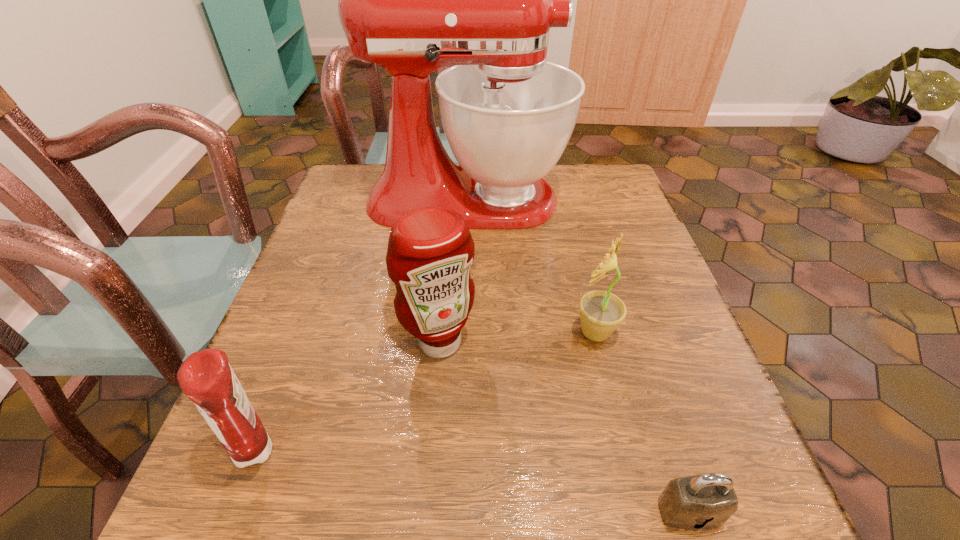
What are the coordinates of `blank space at the right edge of the desktop` in the screenshot? It's located at (633, 400).

This screenshot has width=960, height=540. What are the coordinates of `vacant area at the far left corner` in the screenshot? It's located at (370, 178).

This screenshot has width=960, height=540. I want to click on free space at the far right corner of the desktop, so click(x=561, y=178).

Identify the location of vacant space in between the padlock and the farther condiment. The image size is (960, 540). (564, 427).

This screenshot has height=540, width=960. In order to click on vacant space that is in between the leftmost object and the taller condiment in this screenshot , I will do `click(348, 396)`.

Locate an element on the screen. Image resolution: width=960 pixels, height=540 pixels. empty space that is in between the sunflower and the nearest object is located at coordinates [x=642, y=422].

In order to click on free space between the nearest object and the sunflower in this screenshot , I will do `click(642, 422)`.

Find the location of `blank region between the fourth shortest object and the sunflower`. blank region between the fourth shortest object and the sunflower is located at coordinates (517, 338).

At what (x,y) coordinates should I click in order to perform the action: click on free space between the second tallest object and the second nearest object. Please return your answer as a coordinate pair (x, y). This screenshot has height=540, width=960. Looking at the image, I should click on (348, 396).

Locate an element on the screen. Image resolution: width=960 pixels, height=540 pixels. free space between the sunflower and the leftmost object is located at coordinates (426, 391).